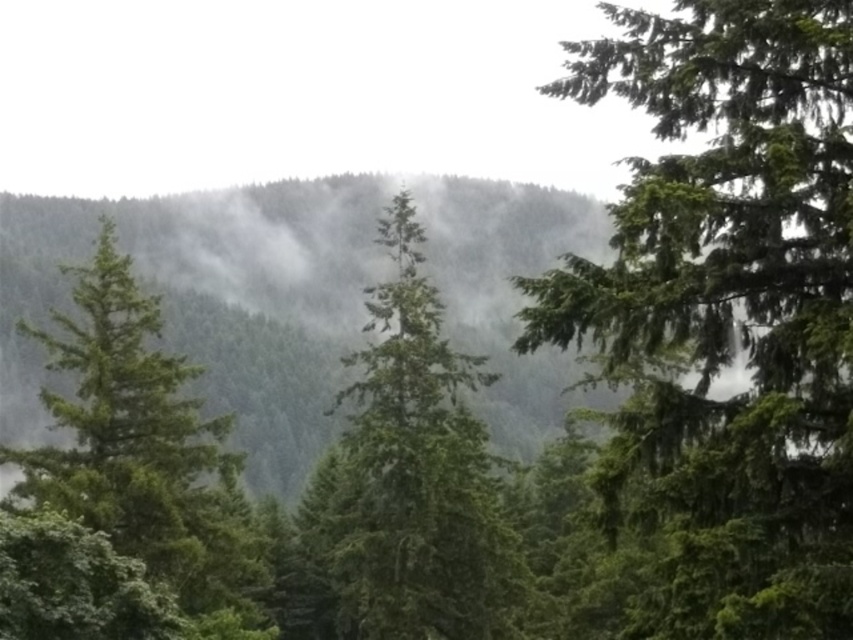
You are a hiker navigating through the dense forest depicted in the image. You come across two points marked on your map. The first point is at coordinate point (349, 545) and the second is at point (207, 576). Which point is farther away from your current position?

Point (349, 545) is behind point (207, 576), so it is farther away from your current position.

You are a hiker with a laser rangefinder. You are standing in a dense forest and see the green matte tree at center. Your rangefinder shows it is 35.88 meters away. Is this tree closer or farther than 30 meters?

The green matte tree at center is 35.88 meters away from the camera, so it is farther than 30 meters.

You are a hiker standing at the center of the forest. You notice two trees in the scene. Which tree, the green matte tree at upper right or the green matte tree at left, is closer to you?

The green matte tree at upper right is closer to you because it has a smaller size compared to the green matte tree at left, which is farther away.